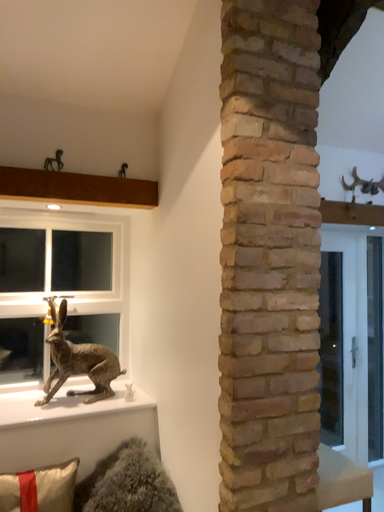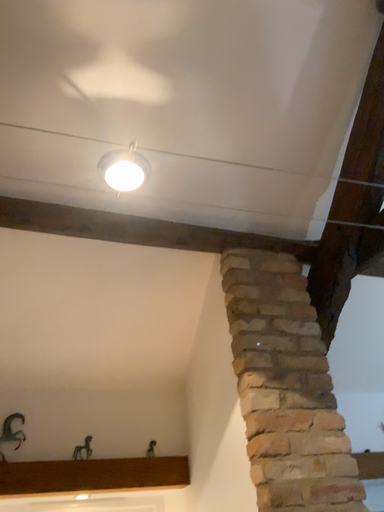
Question: Which way did the camera rotate in the video?

Choices:
 (A) rotated upward
 (B) rotated downward

Answer: (A)